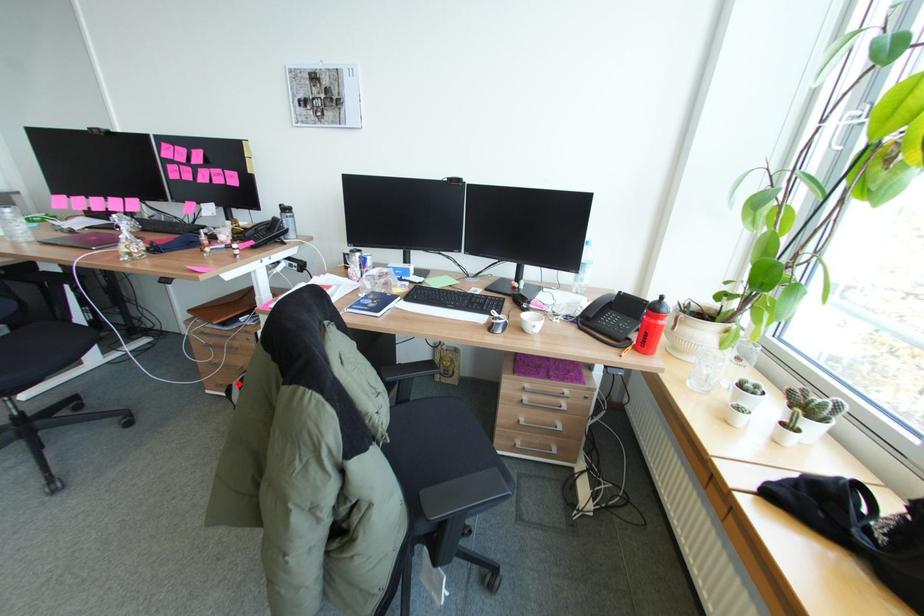
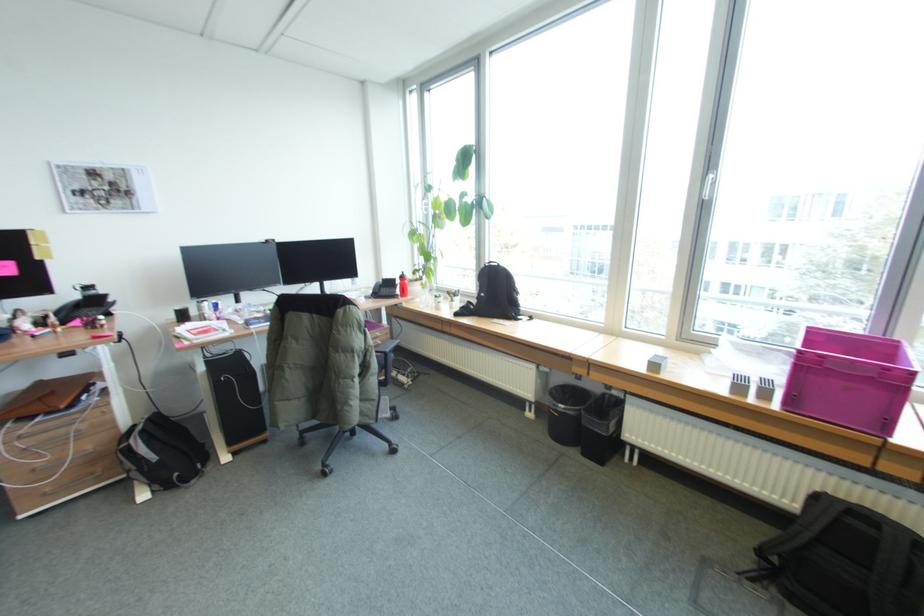
The point at the highlighted location is marked in the first image. Where is the corresponding point in the second image?

(135, 444)